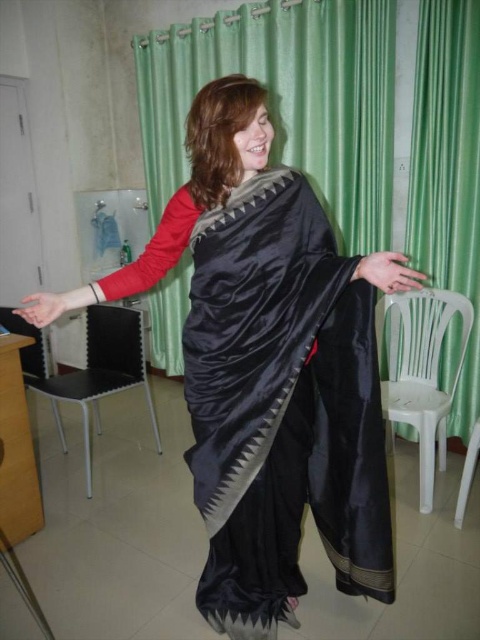
Based on the photo, you are a photographer setting up a shoot in this room. You want to position a model so they can be seen clearly through the green satin curtain at upper center without the white plastic chair at lower right blocking the view. Where should you place the model?

The white plastic chair at lower right is behind the green satin curtain at upper center, so to avoid blocking the view, the model should be positioned in front of the green satin curtain at upper center where the chair isn